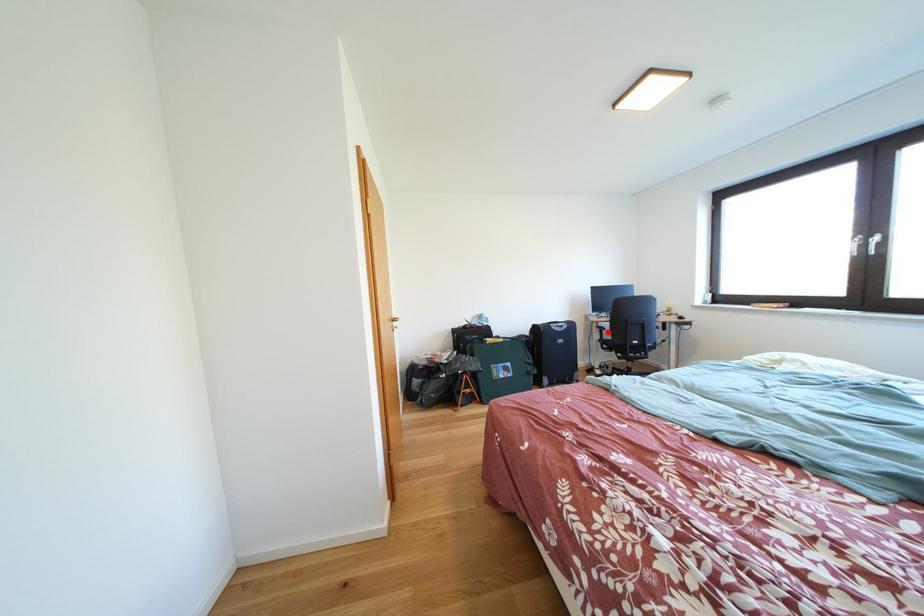
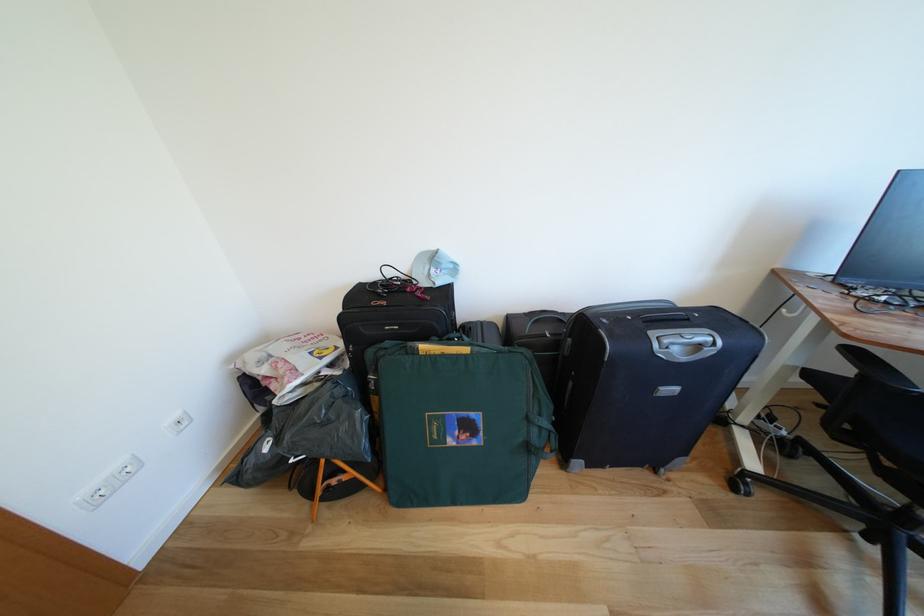
Find the pixel in the second image that matches the highlighted location in the first image.

(862, 357)